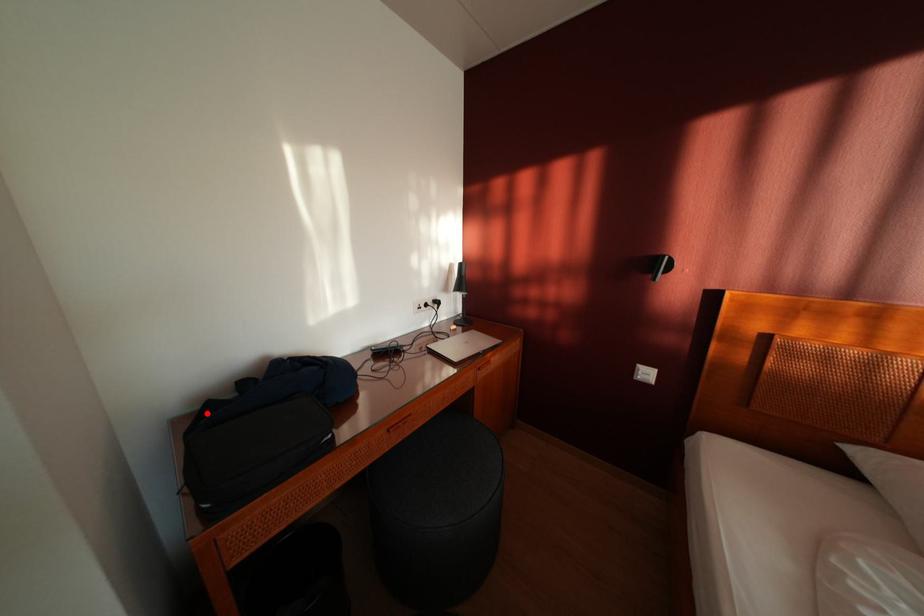
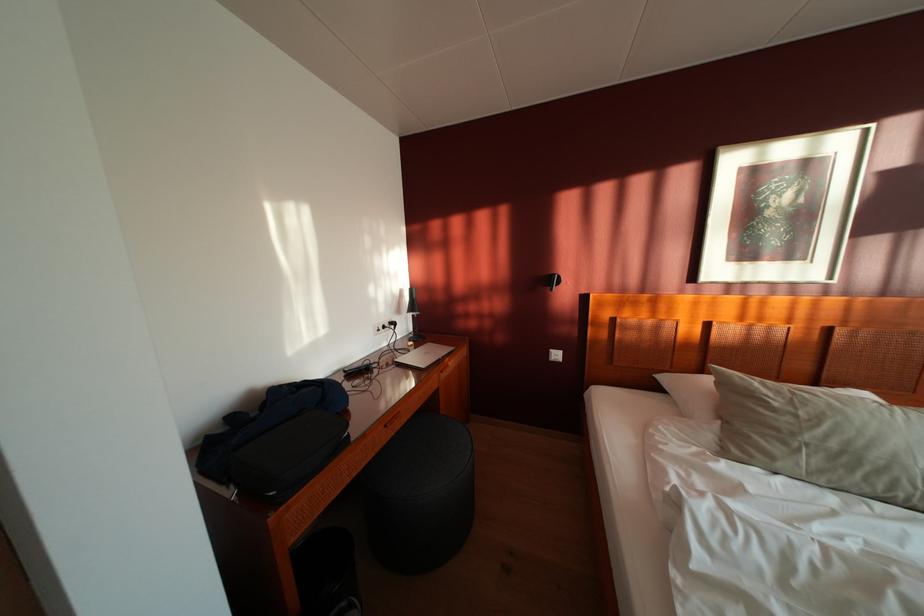
The point at the highlighted location is marked in the first image. Where is the corresponding point in the second image?

(208, 448)